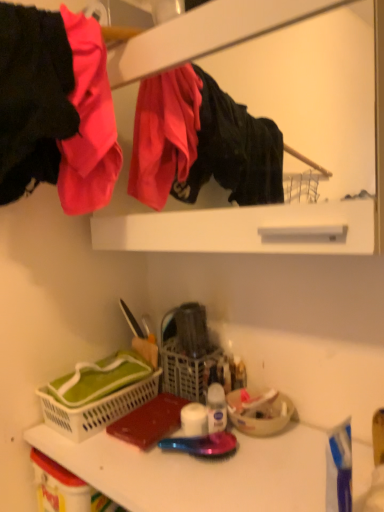
Question: Is white plastic basket at lower left closer to the viewer compared to white matte toilet paper at center?

Choices:
 (A) yes
 (B) no

Answer: (A)

Question: Is white plastic basket at lower left facing away from white matte toilet paper at center?

Choices:
 (A) no
 (B) yes

Answer: (A)

Question: Is white plastic basket at lower left with white matte toilet paper at center?

Choices:
 (A) yes
 (B) no

Answer: (B)

Question: Is there a large distance between white plastic basket at lower left and white matte toilet paper at center?

Choices:
 (A) yes
 (B) no

Answer: (B)

Question: Can you confirm if white plastic basket at lower left is shorter than white matte toilet paper at center?

Choices:
 (A) yes
 (B) no

Answer: (B)

Question: From the image's perspective, relative to transparent plastic spray bottle at center, is white plastic basket at lower left above or below?

Choices:
 (A) above
 (B) below

Answer: (A)

Question: Does point (135, 394) appear closer or farther from the camera than point (210, 393)?

Choices:
 (A) closer
 (B) farther

Answer: (B)

Question: Based on their positions, is white plastic basket at lower left located to the left or right of transparent plastic spray bottle at center?

Choices:
 (A) right
 (B) left

Answer: (B)

Question: Considering the positions of white plastic basket at lower left and transparent plastic spray bottle at center in the image, is white plastic basket at lower left bigger or smaller than transparent plastic spray bottle at center?

Choices:
 (A) big
 (B) small

Answer: (A)

Question: In terms of height, does transparent plastic spray bottle at center look taller or shorter compared to white matte toilet paper at center?

Choices:
 (A) tall
 (B) short

Answer: (A)

Question: Is transparent plastic spray bottle at center bigger or smaller than white matte toilet paper at center?

Choices:
 (A) big
 (B) small

Answer: (B)

Question: From the image's perspective, is transparent plastic spray bottle at center positioned above or below white matte toilet paper at center?

Choices:
 (A) below
 (B) above

Answer: (B)

Question: Relative to white matte toilet paper at center, is transparent plastic spray bottle at center in front or behind?

Choices:
 (A) front
 (B) behind

Answer: (A)

Question: From a real-world perspective, is matte black jacket at upper left above or below matte white medicine cabinet at upper center?

Choices:
 (A) above
 (B) below

Answer: (A)

Question: Is matte black jacket at upper left bigger or smaller than matte white medicine cabinet at upper center?

Choices:
 (A) big
 (B) small

Answer: (B)